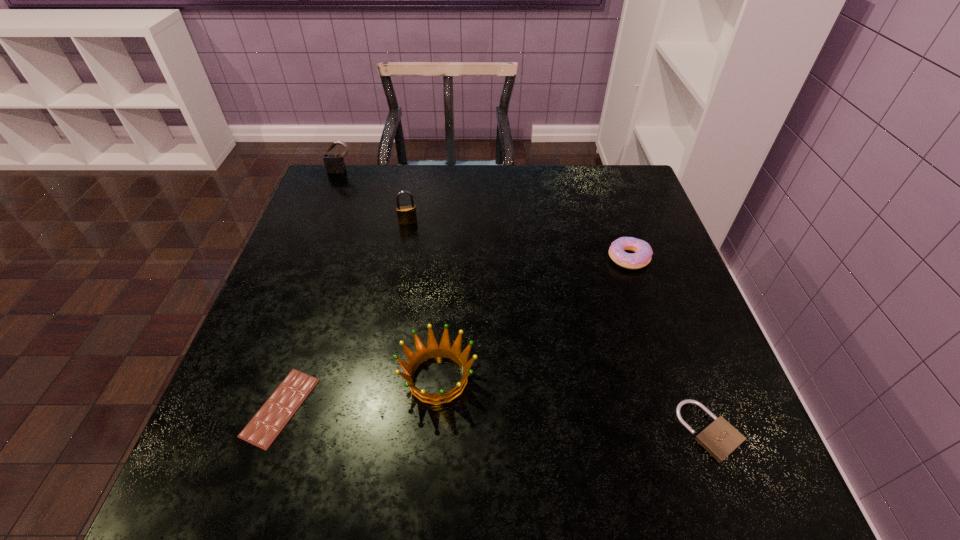
You are a GUI agent. You are given a task and a screenshot of the screen. Output one action in this format:
    pyautogui.click(x=<x>, y=<y>)
    Task: Click on the leftmost padlock
    Image resolution: width=960 pixels, height=540 pixels.
    Given the screenshot: What is the action you would take?
    pyautogui.click(x=334, y=163)

The height and width of the screenshot is (540, 960). Find the location of `the farthest padlock`. the farthest padlock is located at coordinates (334, 163).

Locate an element on the screen. The height and width of the screenshot is (540, 960). the fifth nearest object is located at coordinates (407, 214).

What are the coordinates of `the second farthest padlock` in the screenshot? It's located at click(407, 214).

Locate an element on the screen. the fourth object from left to right is located at coordinates (433, 349).

Identify the location of crown. This screenshot has width=960, height=540. (433, 349).

At what (x,y) coordinates should I click in order to perform the action: click on doughnut. Please return your answer as a coordinate pair (x, y). The height and width of the screenshot is (540, 960). Looking at the image, I should click on (643, 253).

This screenshot has height=540, width=960. In order to click on the fourth nearest object in this screenshot , I will do `click(643, 253)`.

Find the location of a particular element. the second shortest object is located at coordinates (720, 438).

You are a GUI agent. You are given a task and a screenshot of the screen. Output one action in this format:
    pyautogui.click(x=<x>, y=<y>)
    Task: Click on the shortest padlock
    Image resolution: width=960 pixels, height=540 pixels.
    Given the screenshot: What is the action you would take?
    pyautogui.click(x=720, y=438)